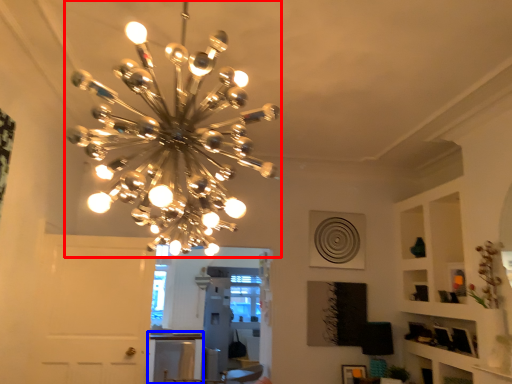
Question: Which object is further to the camera taking this photo, lamp (highlighted by a red box) or table (highlighted by a blue box)?

Choices:
 (A) lamp
 (B) table

Answer: (B)